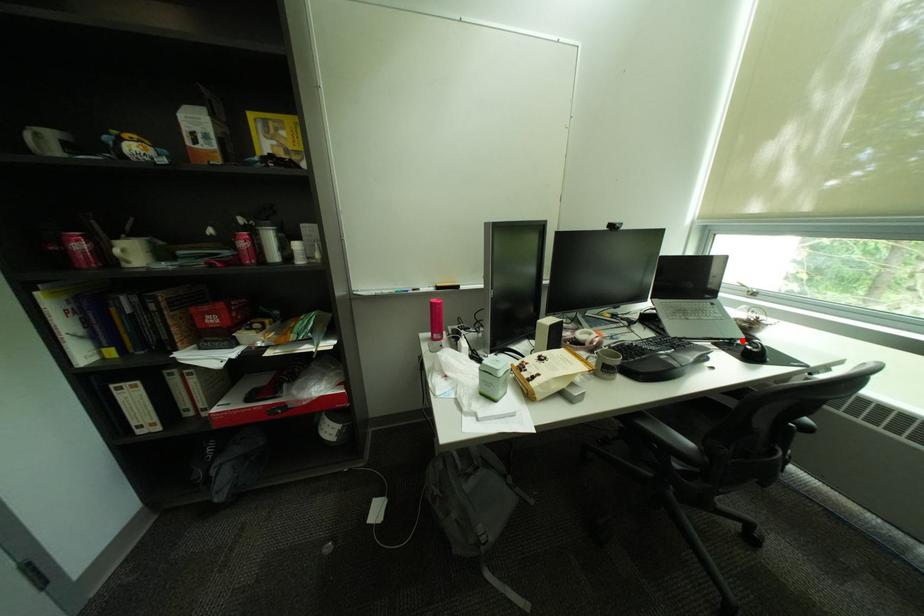
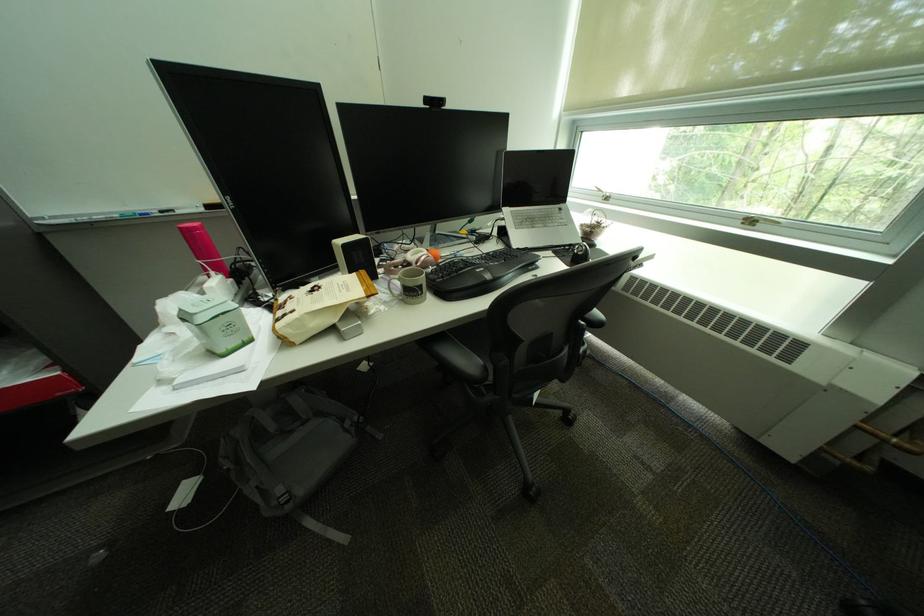
Find the pixel in the second image that matches the highlighted location in the first image.

(580, 246)